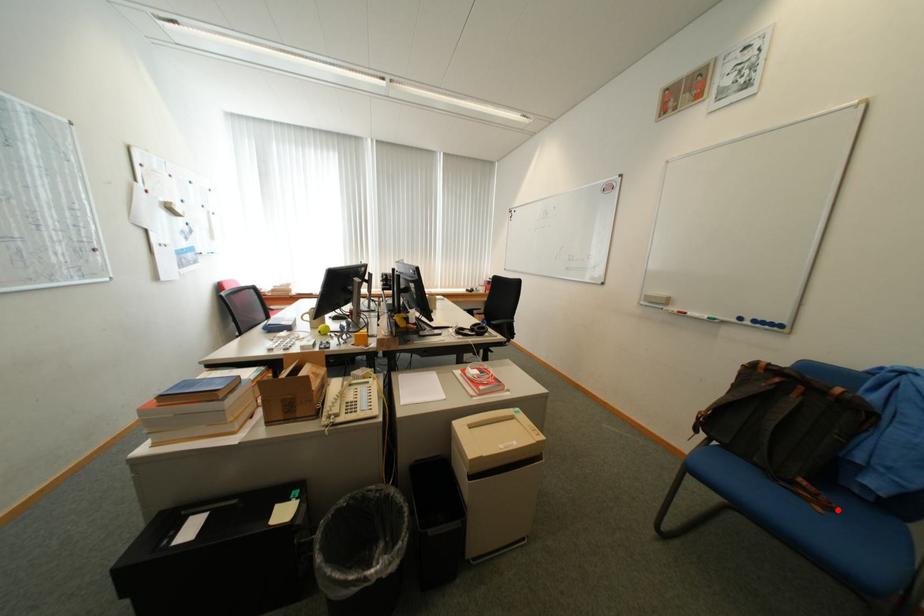
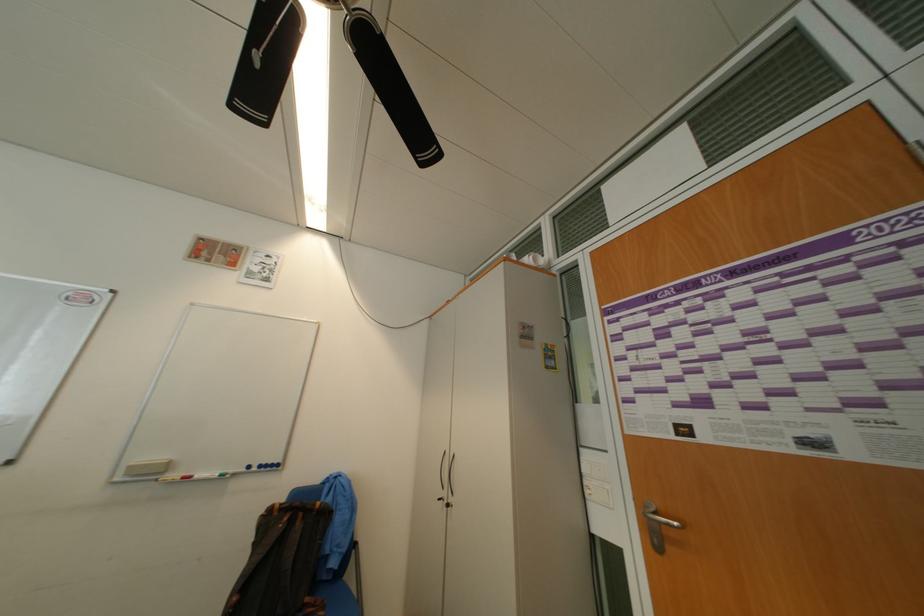
Question: I am providing you with two images of the same scene from different viewpoints. Given a red point in image1, look at the same physical point in image2. Is it:

Choices:
 (A) Closer to the viewpoint
 (B) Farther from the viewpoint

Answer: (B)